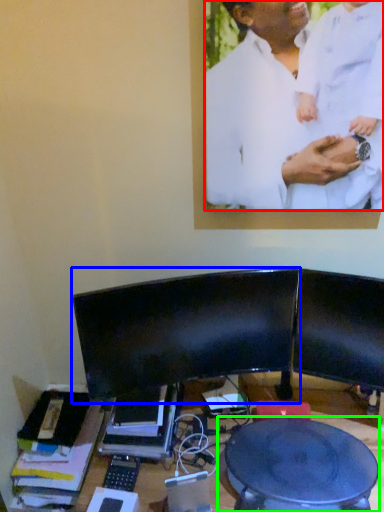
Question: Which is farther away from man (highlighted by a red box)? computer monitor (highlighted by a blue box) or round table (highlighted by a green box)?

Choices:
 (A) computer monitor
 (B) round table

Answer: (B)